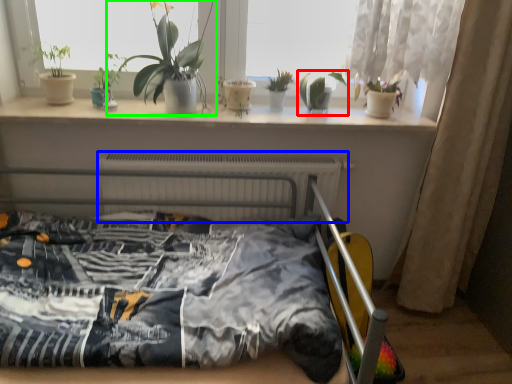
Question: Which object is the farthest from houseplant (highlighted by a red box)? Choose among these: radiator (highlighted by a blue box) or houseplant (highlighted by a green box).

Choices:
 (A) radiator
 (B) houseplant

Answer: (B)